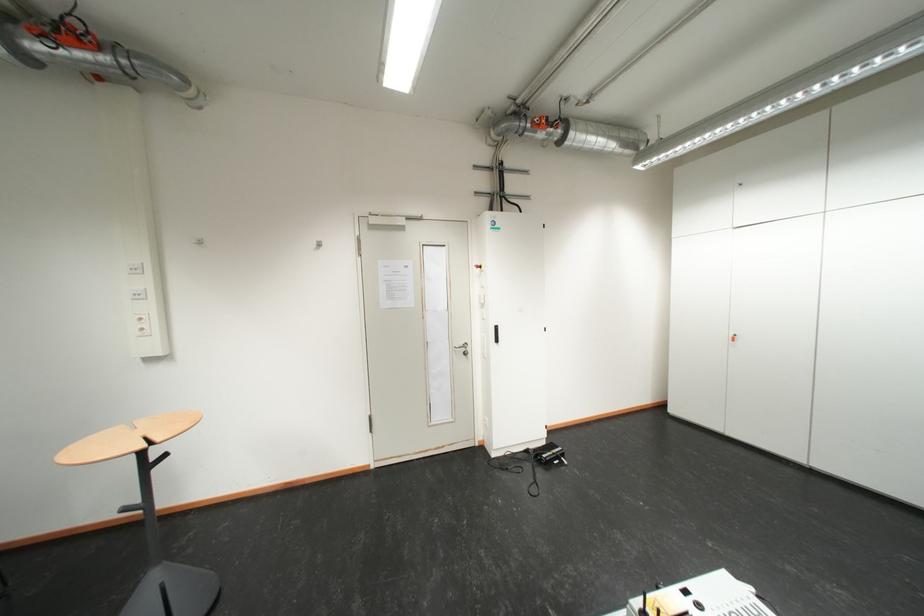
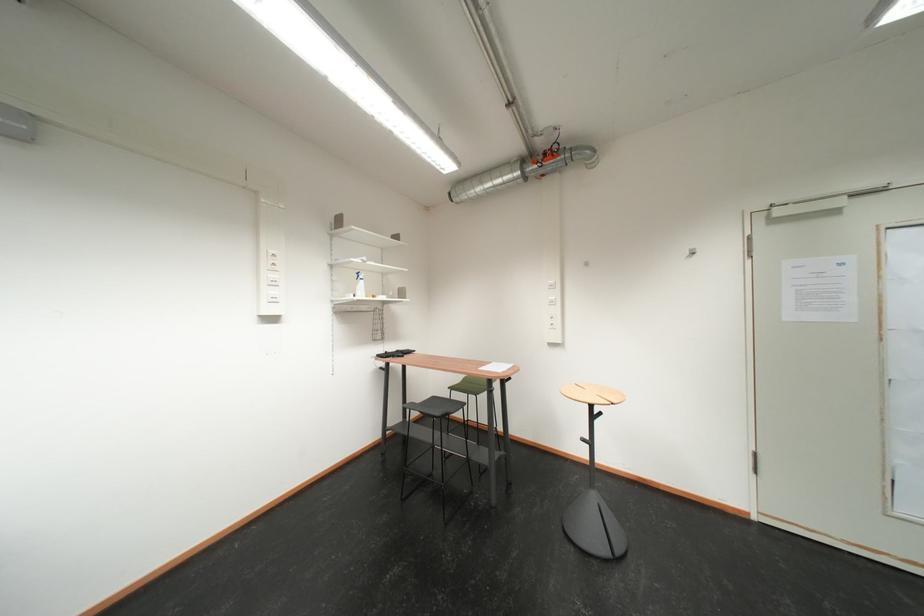
Question: The camera is either moving clockwise (left) or counter-clockwise (right) around the object. The first image is from the beginning of the video and the second image is from the end. Is the camera moving left or right when shooting the video?

Choices:
 (A) Left
 (B) Right

Answer: (B)